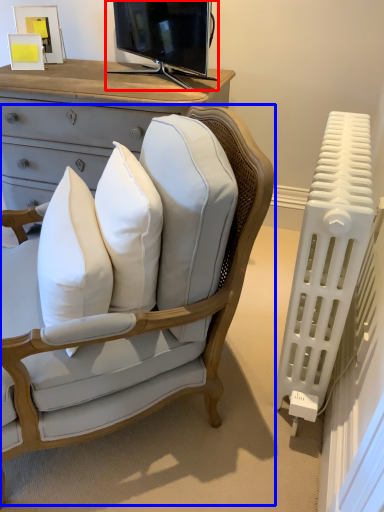
Question: Which object appears closest to the camera in this image, television (highlighted by a red box) or chair (highlighted by a blue box)?

Choices:
 (A) television
 (B) chair

Answer: (B)